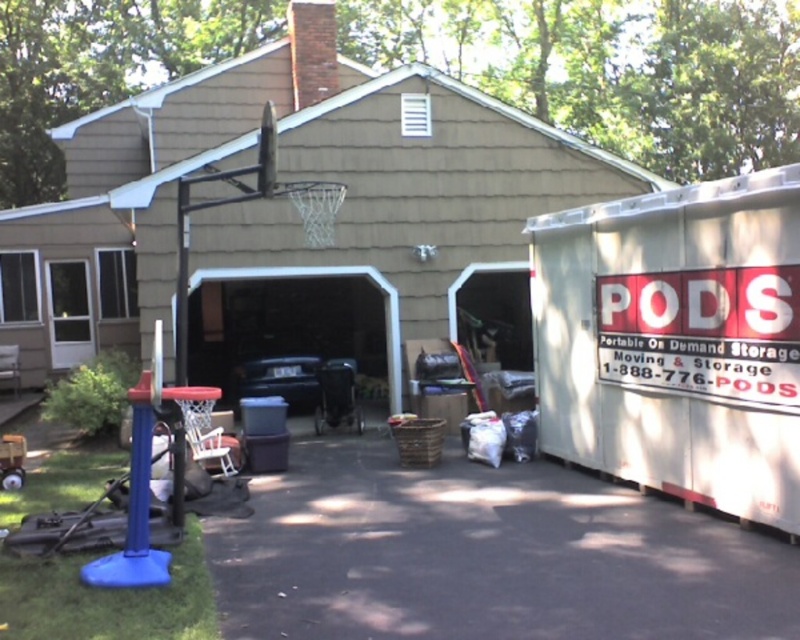
Question: Among these points, which one is nearest to the camera?

Choices:
 (A) (517, 260)
 (B) (356, 273)

Answer: (B)

Question: Can you confirm if black asphalt driveway at lower center is thinner than matte black carport at center?

Choices:
 (A) no
 (B) yes

Answer: (A)

Question: Among these objects, which one is nearest to the camera?

Choices:
 (A) black asphalt driveway at lower center
 (B) white plastic storage container at right
 (C) matte black carport at center

Answer: (A)

Question: Does white plastic storage container at right have a lesser width compared to black asphalt driveway at lower center?

Choices:
 (A) yes
 (B) no

Answer: (B)

Question: Does white plastic storage container at right have a smaller size compared to black asphalt driveway at lower center?

Choices:
 (A) yes
 (B) no

Answer: (B)

Question: Which point is farther to the camera?

Choices:
 (A) white plastic storage container at right
 (B) black asphalt driveway at lower center

Answer: (A)